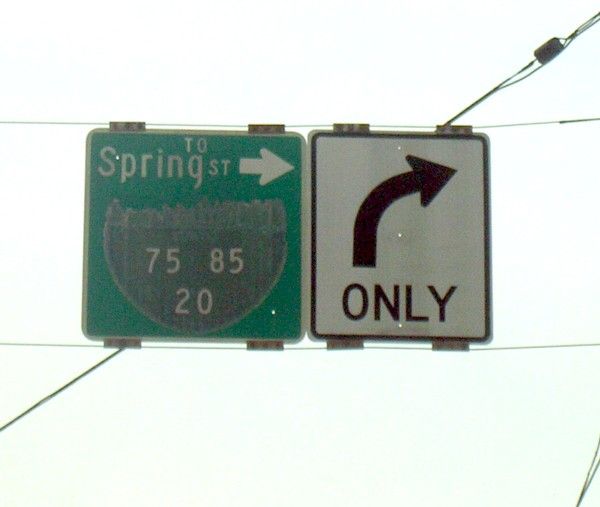
Identify the location of wire going across behind signs. Image resolution: width=600 pixels, height=507 pixels. (88, 373).